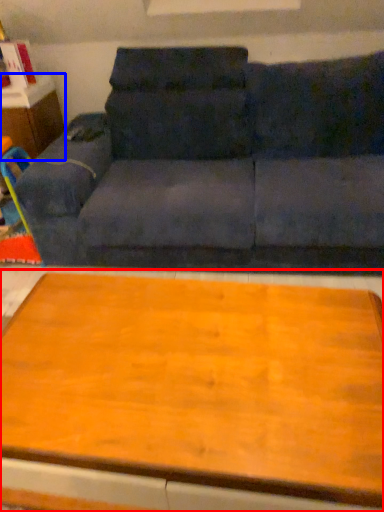
Question: Among these objects, which one is farthest to the camera, table (highlighted by a red box) or dresser (highlighted by a blue box)?

Choices:
 (A) table
 (B) dresser

Answer: (B)